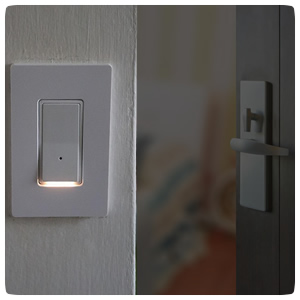
I want to click on wall, so click(x=212, y=46).